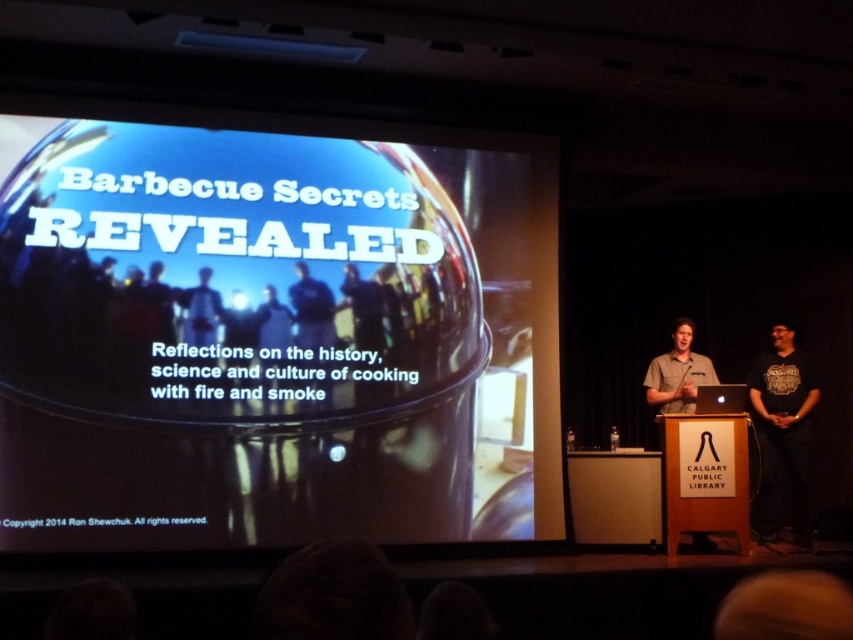
Question: Is matte black barbecue grill at center positioned before black cotton t-shirt at right?

Choices:
 (A) no
 (B) yes

Answer: (B)

Question: Among these points, which one is farthest from the camera?

Choices:
 (A) (221, 316)
 (B) (347, 298)

Answer: (B)

Question: Which is farther from the matte black shirt at center?

Choices:
 (A) matte black barbecue grill at center
 (B) black cotton t-shirt at right

Answer: (B)

Question: Can you confirm if matte black barbecue grill at center is smaller than matte black shirt at center?

Choices:
 (A) no
 (B) yes

Answer: (A)

Question: Is matte black barbecue grill at center closer to the viewer compared to matte black shirt at center?

Choices:
 (A) yes
 (B) no

Answer: (A)

Question: Among these objects, which one is farthest from the camera?

Choices:
 (A) matte black barbecue grill at center
 (B) matte black shirt at center

Answer: (B)